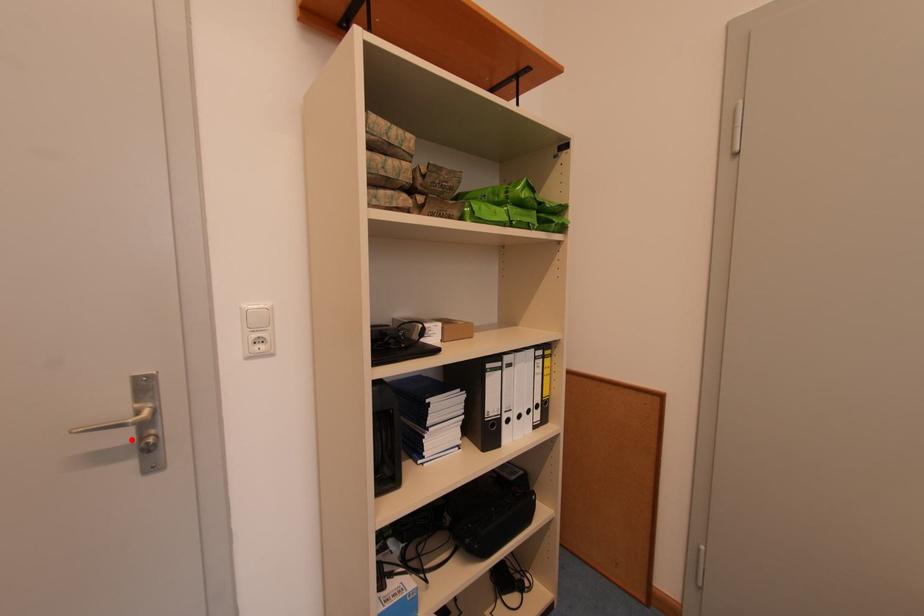
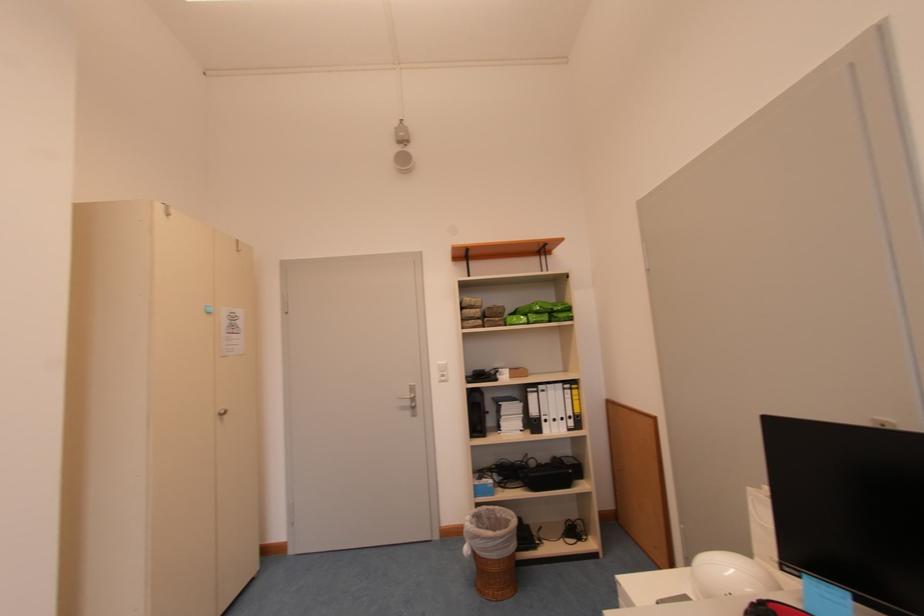
In the second image, find the point that corresponds to the highlighted location in the first image.

(415, 406)